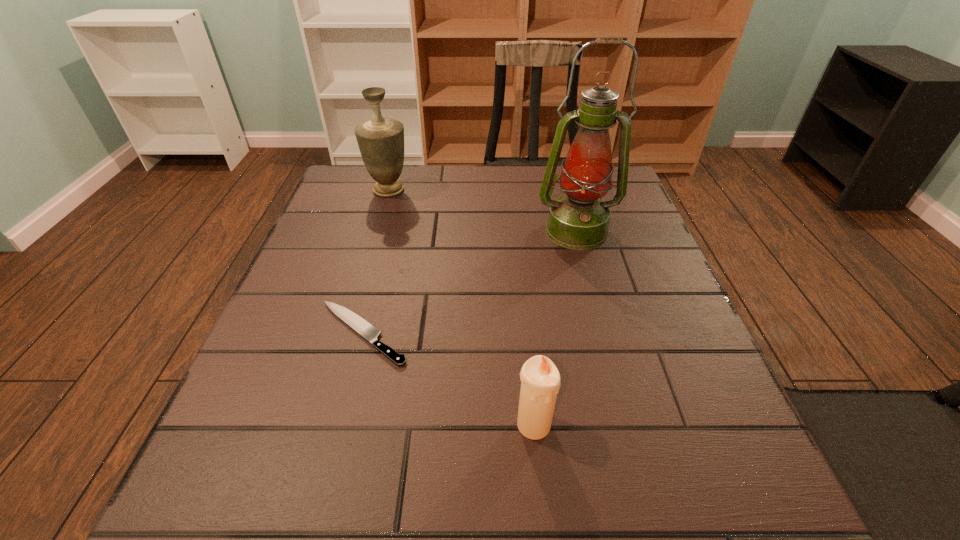
The height and width of the screenshot is (540, 960). I want to click on the rightmost object, so click(x=579, y=220).

The height and width of the screenshot is (540, 960). I want to click on the third nearest object, so click(x=579, y=220).

Locate an element on the screen. the second tallest object is located at coordinates (381, 140).

Locate an element on the screen. This screenshot has width=960, height=540. the farthest object is located at coordinates (381, 140).

Find the location of a particular element. The image size is (960, 540). the third object from left to right is located at coordinates (540, 379).

At what (x,y) coordinates should I click in order to perform the action: click on the second shortest object. Please return your answer as a coordinate pair (x, y). This screenshot has height=540, width=960. Looking at the image, I should click on (540, 379).

This screenshot has width=960, height=540. In order to click on the third farthest object in this screenshot , I will do `click(360, 325)`.

Where is `steak knife`? steak knife is located at coordinates (360, 325).

In order to click on vacant region located 0.130m on the left of the rightmost object in this screenshot , I will do (481, 231).

You are a GUI agent. You are given a task and a screenshot of the screen. Output one action in this format:
    pyautogui.click(x=<x>, y=<y>)
    Task: Click on the vacant space located 0.270m on the right of the farthest object
    
    Given the screenshot: What is the action you would take?
    pyautogui.click(x=512, y=190)